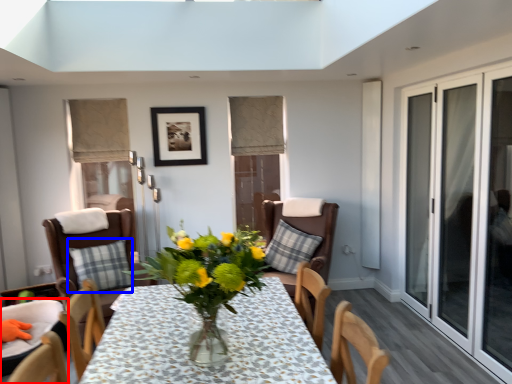
Question: Which object is closer to the camera taking this photo, chair (highlighted by a red box) or pillow (highlighted by a blue box)?

Choices:
 (A) chair
 (B) pillow

Answer: (A)